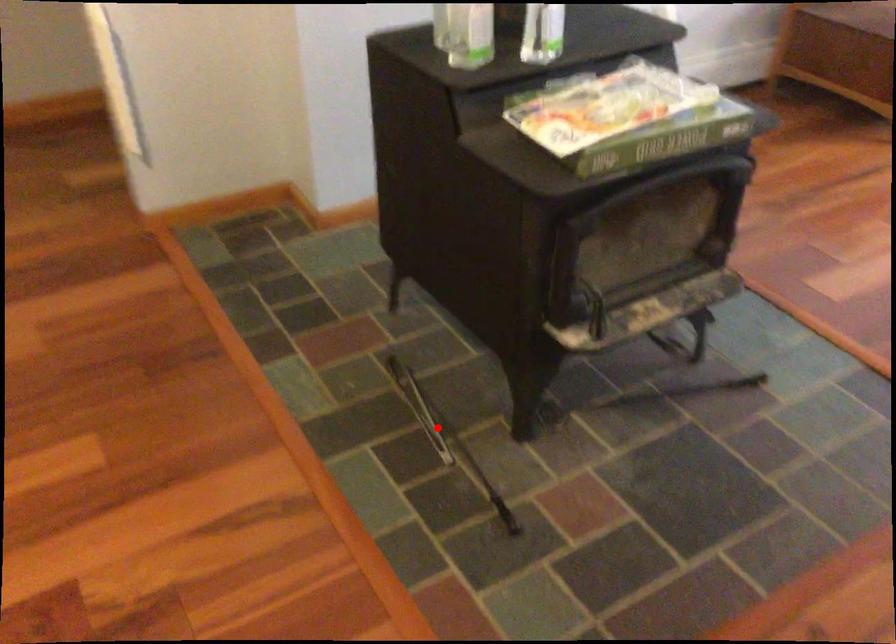
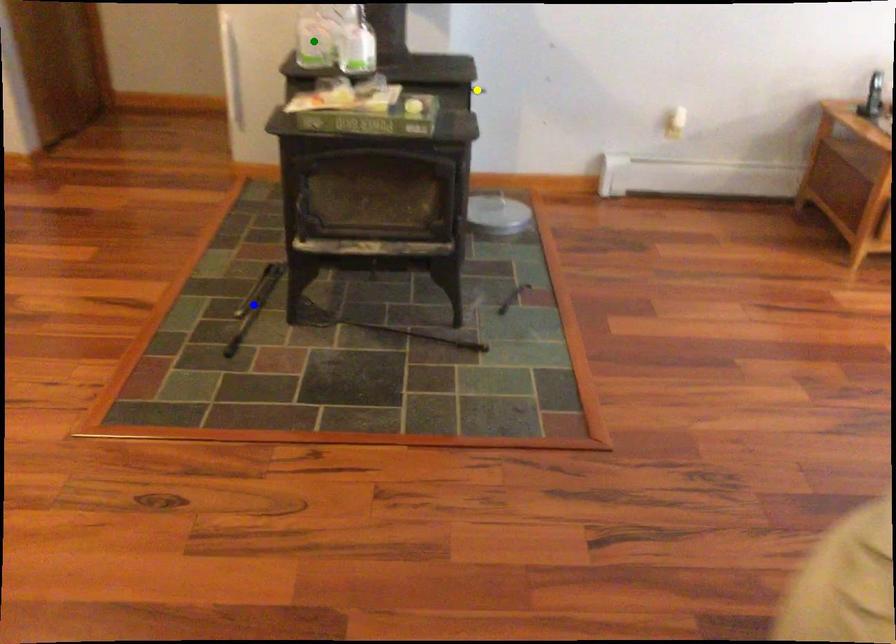
Question: I am providing you with two images of the same scene from different viewpoints. A red point is marked on the first image. You are given multiple points on the second image. Which spot in image 2 lines up with the point in image 1?

Choices:
 (A) blue point
 (B) green point
 (C) yellow point

Answer: (A)